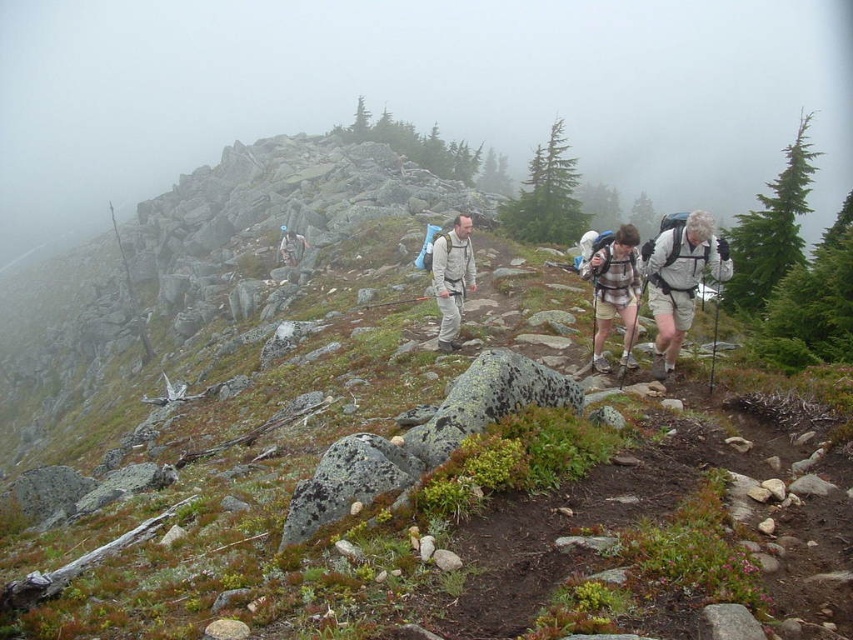
Question: Which point appears farthest from the camera in this image?

Choices:
 (A) (672, 360)
 (B) (601, 253)
 (C) (302, 241)

Answer: (C)

Question: Which of these objects is positioned closest to the matte gray backpack at upper center?

Choices:
 (A) striped fabric backpack at center
 (B) white matte backpack at right
 (C) matte gray backpack at center

Answer: (C)

Question: Where is striped fabric backpack at center located in relation to matte gray backpack at center in the image?

Choices:
 (A) below
 (B) above

Answer: (A)

Question: Can you confirm if white matte backpack at right is thinner than matte gray backpack at center?

Choices:
 (A) no
 (B) yes

Answer: (A)

Question: Does striped fabric backpack at center appear over matte gray backpack at upper center?

Choices:
 (A) yes
 (B) no

Answer: (B)

Question: Among these objects, which one is farthest from the camera?

Choices:
 (A) matte gray backpack at center
 (B) white matte backpack at right
 (C) striped fabric backpack at center

Answer: (A)